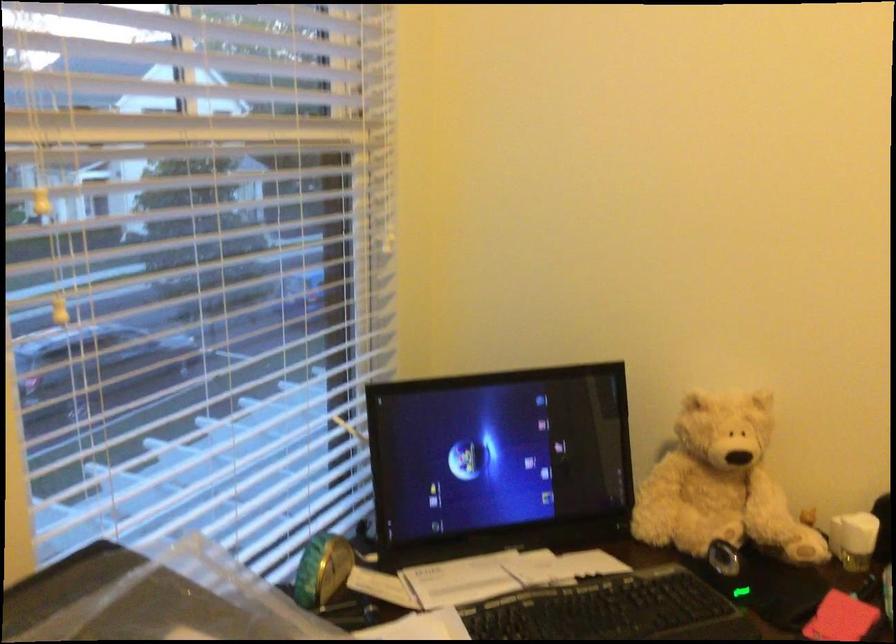
Find where to squeez the light brown teddy bear. Please return your answer as a coordinate pair (x, y).

(720, 484)